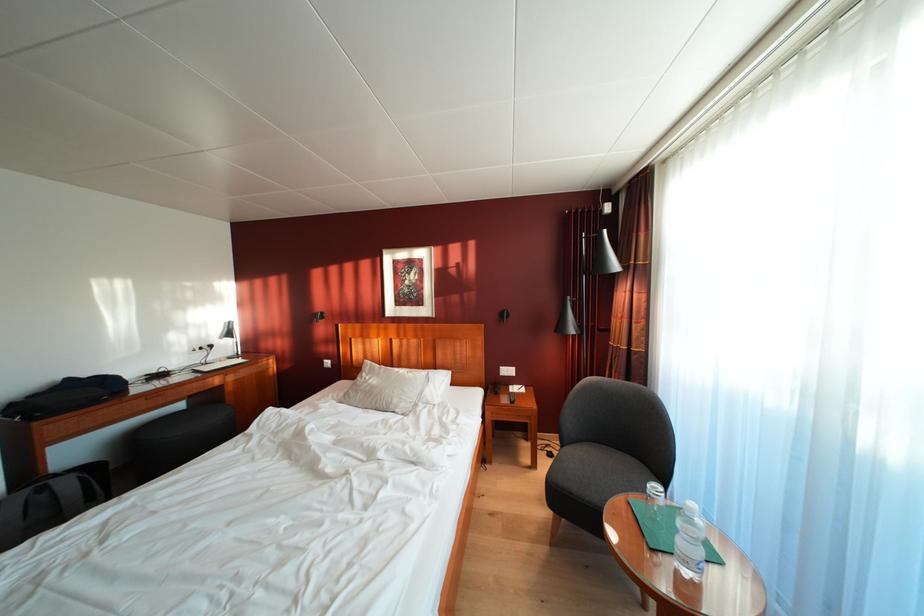
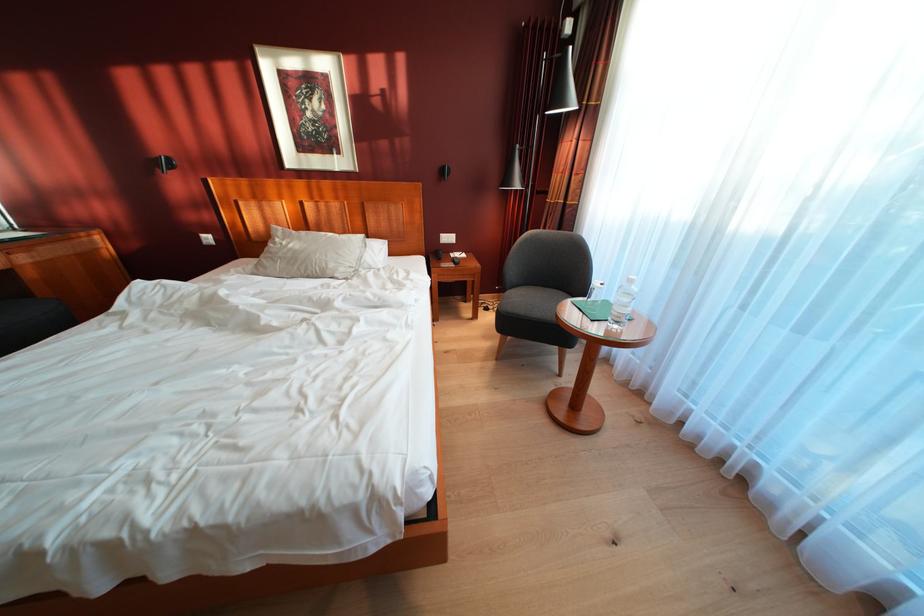
Locate, in the second image, the point that corresponds to the point at 399,413 in the first image.

(336, 278)